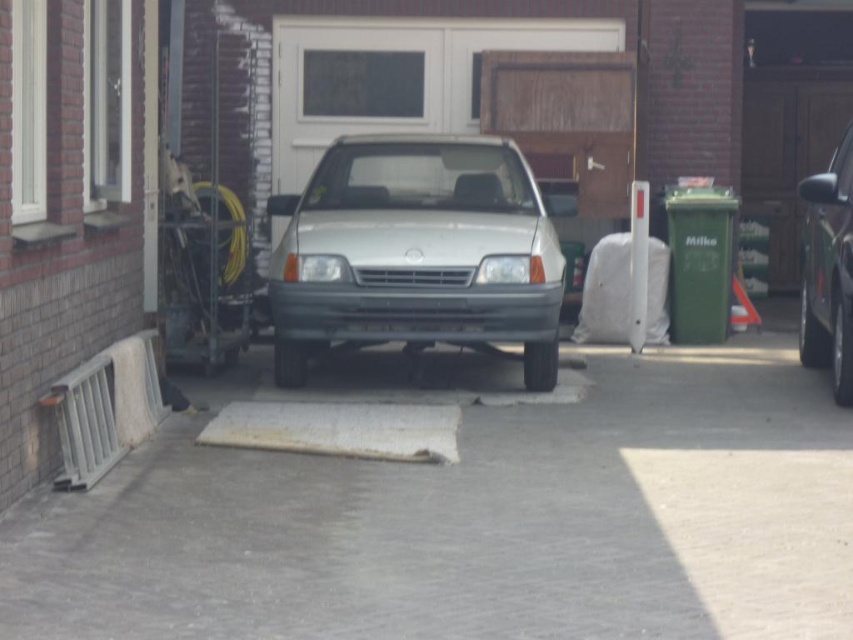
Between point (3, 531) and point (347, 257), which one is positioned behind?

Positioned behind is point (347, 257).

Is the position of gray concrete driveway at center less distant than that of satin silver car at center?

Yes, it is in front of satin silver car at center.

Is point (764, 573) closer to viewer compared to point (469, 237)?

Yes.

Locate an element on the screen. Image resolution: width=853 pixels, height=640 pixels. gray concrete driveway at center is located at coordinates (476, 524).

Measure the distance from gray concrete driveway at center to shiny metallic suv at right.

gray concrete driveway at center and shiny metallic suv at right are 3.98 meters apart from each other.

In the scene shown: Who is lower down, gray concrete driveway at center or shiny metallic suv at right?

gray concrete driveway at center is below.

Find the location of a particular element. The image size is (853, 640). gray concrete driveway at center is located at coordinates (476, 524).

Is satin silver car at center closer to the viewer compared to shiny metallic suv at right?

No, satin silver car at center is further to the viewer.

Who is higher up, satin silver car at center or shiny metallic suv at right?

satin silver car at center is higher up.

Between point (549, 337) and point (811, 317), which one is positioned in front?

Point (549, 337)

Find the location of a particular element. This screenshot has width=853, height=640. satin silver car at center is located at coordinates (416, 252).